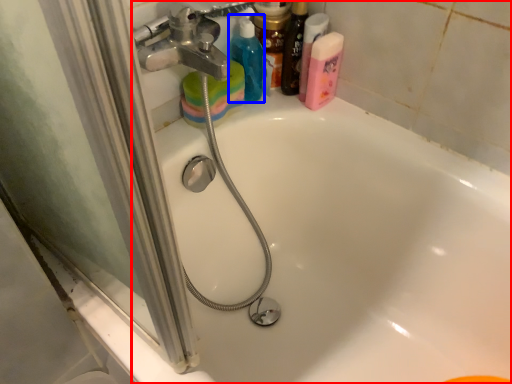
Question: Which of the following is the farthest to the observer, bathtub (highlighted by a red box) or cleaning product (highlighted by a blue box)?

Choices:
 (A) bathtub
 (B) cleaning product

Answer: (B)